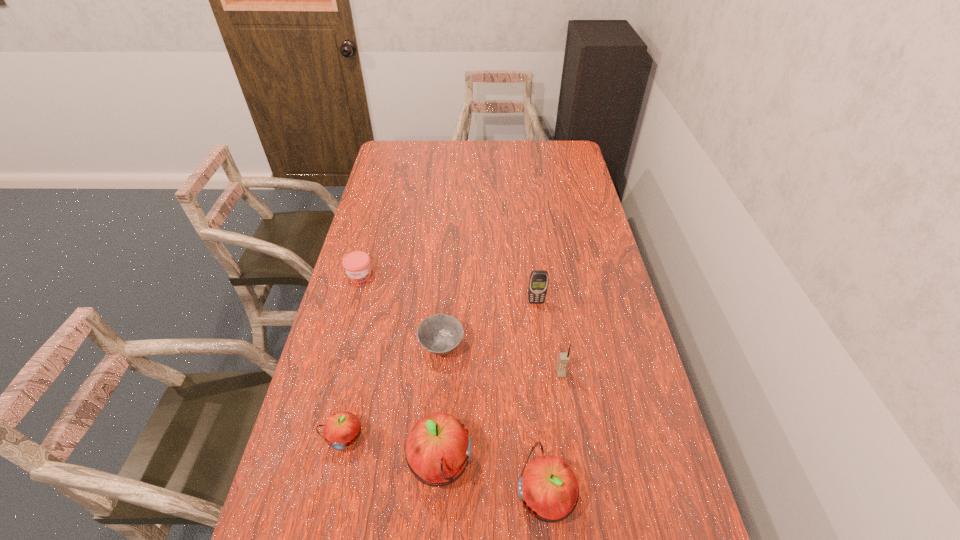
Image resolution: width=960 pixels, height=540 pixels. Find the location of `blank space at the right edge of the desktop`. blank space at the right edge of the desktop is located at coordinates (613, 491).

In the image, there is a desktop. Where is `blank space at the far right corner`? blank space at the far right corner is located at coordinates (557, 141).

You are a GUI agent. You are given a task and a screenshot of the screen. Output one action in this format:
    pyautogui.click(x=<x>, y=<y>)
    Task: Click on the vacant space at the near right corner of the desktop
    The height and width of the screenshot is (540, 960).
    Given the screenshot: What is the action you would take?
    pyautogui.click(x=636, y=517)

Where is `vacant area that lies between the jam and the shortest apple`? The width and height of the screenshot is (960, 540). vacant area that lies between the jam and the shortest apple is located at coordinates (352, 356).

Identify the location of vacant area that lies between the farther cellular telephone and the second shortest apple. (540, 399).

Where is `free spot between the bowl and the jam`? free spot between the bowl and the jam is located at coordinates (x=401, y=311).

The width and height of the screenshot is (960, 540). Identify the location of blank region between the rightmost apple and the nearer cellular telephone. (553, 435).

This screenshot has height=540, width=960. In order to click on vacant space in between the rightmost apple and the nearer cellular telephone in this screenshot , I will do `click(553, 435)`.

Locate an element on the screen. The image size is (960, 540). unoccupied position between the farthest object and the second farthest object is located at coordinates (448, 289).

What are the coordinates of `vacant area that lies between the rightmost apple and the right cellular telephone` in the screenshot? It's located at (553, 435).